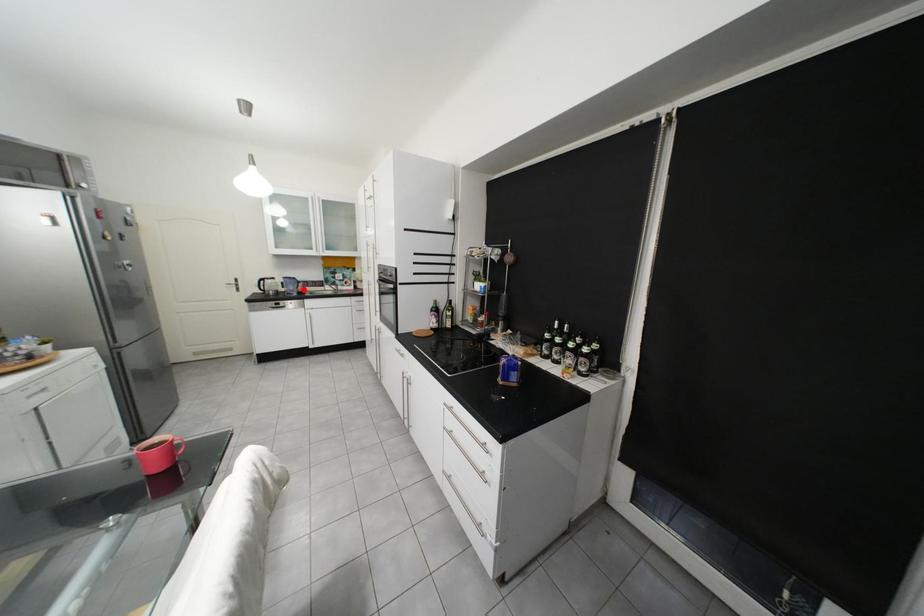
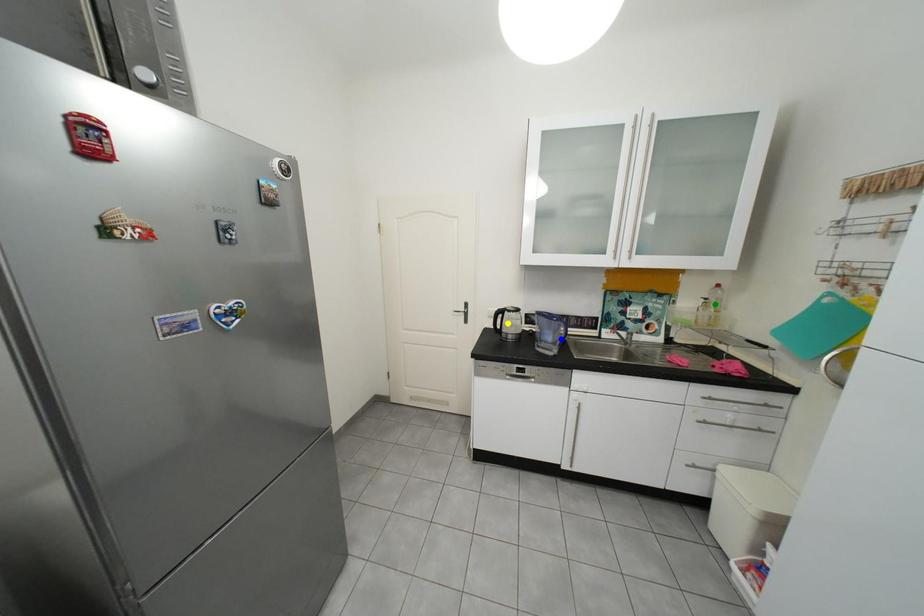
Question: I am providing you with two images of the same scene from different viewpoints. A red point is marked on the first image. You are given multiple points on the second image. In image 2, which mark is for the same physical point as the one in image 1?

Choices:
 (A) green point
 (B) blue point
 (C) yellow point

Answer: (B)